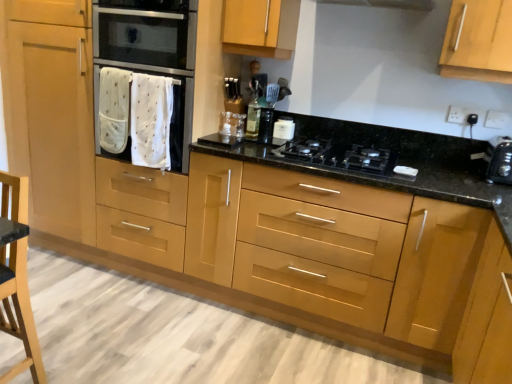
Question: Looking at the image, does wooden armchair at lower left seem bigger or smaller compared to white fabric oven at left?

Choices:
 (A) small
 (B) big

Answer: (A)

Question: From the image's perspective, is wooden armchair at lower left above or below white fabric oven at left?

Choices:
 (A) above
 (B) below

Answer: (B)

Question: Estimate the real-world distances between objects in this image. Which object is closer to the stainless steel oven at center?

Choices:
 (A) black plastic toaster at right
 (B) white fabric oven at left
 (C) translucent glass bottle at center
 (D) wooden armchair at lower left
 (E) black glass gas stove at center

Answer: (B)

Question: Considering the real-world distances, which object is closest to the stainless steel oven at center?

Choices:
 (A) white fabric oven at left
 (B) black plastic toaster at right
 (C) glossy wood drawers at center
 (D) wooden armchair at lower left
 (E) white glossy container at upper center

Answer: (A)